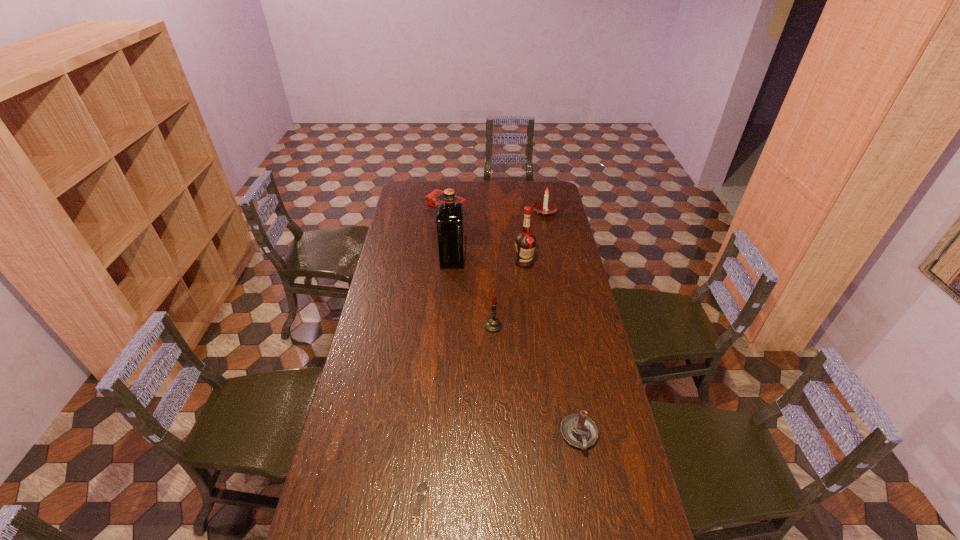
Locate which object ranks third in proximity to the right liquor. Please provide its 2D coordinates. Your answer should be formatted as a tuple, i.e. [(x, y)], where the tuple contains the x and y coordinates of a point satisfying the conditions above.

[(544, 207)]

The width and height of the screenshot is (960, 540). Find the location of `object that is the fifth closest to the fifth farthest object`. object that is the fifth closest to the fifth farthest object is located at coordinates (432, 199).

Identify which candle is the closest to the second farthest candle. Please provide its 2D coordinates. Your answer should be formatted as a tuple, i.e. [(x, y)], where the tuple contains the x and y coordinates of a point satisfying the conditions above.

[(578, 430)]

Identify which candle is the second closest to the nearest object. Please provide its 2D coordinates. Your answer should be formatted as a tuple, i.e. [(x, y)], where the tuple contains the x and y coordinates of a point satisfying the conditions above.

[(493, 325)]

Identify the location of blank space that satisfies the following two spatial constraints: 1. on the front side of the second shortest candle; 2. on the front label of the taller liquor. (555, 259).